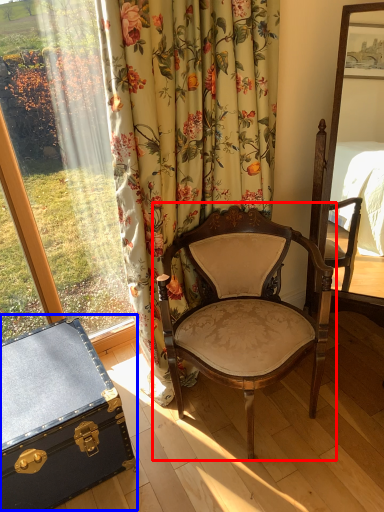
Question: Which point is closer to the camera, chair (highlighted by a red box) or chest (highlighted by a blue box)?

Choices:
 (A) chair
 (B) chest

Answer: (A)